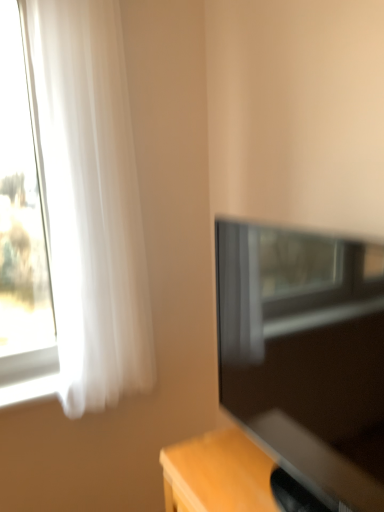
Question: Is matte black tv at right located within white sheer curtain at left?

Choices:
 (A) yes
 (B) no

Answer: (B)

Question: Could you tell me if white sheer curtain at left is facing matte black tv at right?

Choices:
 (A) yes
 (B) no

Answer: (B)

Question: From the image's perspective, would you say white sheer curtain at left is shown under matte black tv at right?

Choices:
 (A) yes
 (B) no

Answer: (B)

Question: From a real-world perspective, is white sheer curtain at left over matte black tv at right?

Choices:
 (A) yes
 (B) no

Answer: (A)

Question: Can you confirm if white sheer curtain at left is thinner than matte black tv at right?

Choices:
 (A) no
 (B) yes

Answer: (B)

Question: Is white sheer curtain at left in contact with matte black tv at right?

Choices:
 (A) yes
 (B) no

Answer: (B)

Question: From the image's perspective, is matte black tv at right on top of white sheer curtain at left?

Choices:
 (A) no
 (B) yes

Answer: (A)

Question: From the image's perspective, would you say matte black tv at right is shown under white sheer curtain at left?

Choices:
 (A) no
 (B) yes

Answer: (B)

Question: Does matte black tv at right appear on the right side of white sheer curtain at left?

Choices:
 (A) yes
 (B) no

Answer: (A)

Question: Is matte black tv at right directly adjacent to white sheer curtain at left?

Choices:
 (A) no
 (B) yes

Answer: (A)

Question: Does matte black tv at right turn towards white sheer curtain at left?

Choices:
 (A) no
 (B) yes

Answer: (A)

Question: Can you confirm if matte black tv at right is shorter than white sheer curtain at left?

Choices:
 (A) yes
 (B) no

Answer: (A)

Question: Is matte black tv at right to the left or to the right of white sheer curtain at left in the image?

Choices:
 (A) right
 (B) left

Answer: (A)